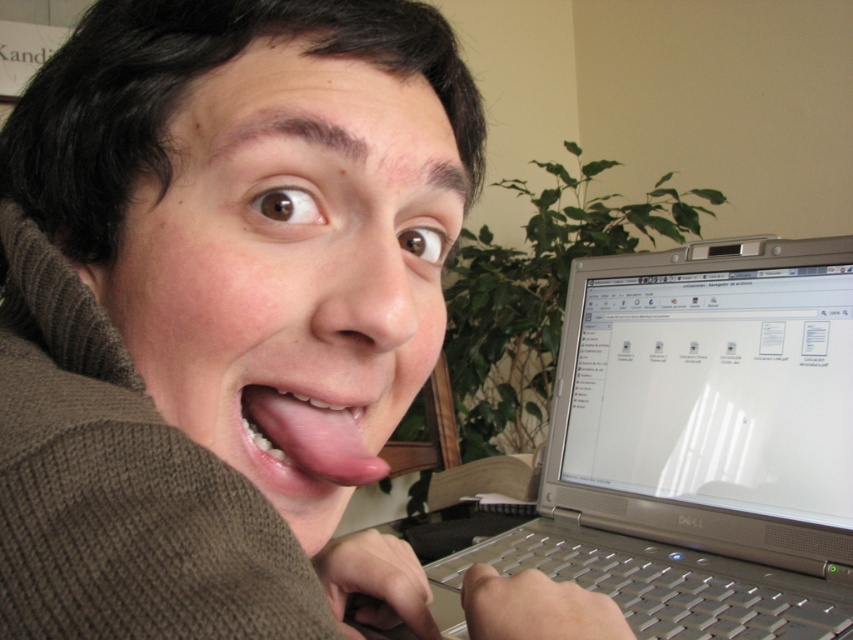
You are a photographer trying to capture the silver metallic laptop at upper right in focus while keeping the matte brown sweater at center visible but slightly blurred. Is the laptop at a different depth compared to the sweater?

The matte brown sweater at center is positioned over the silver metallic laptop at upper right, meaning the sweater is closer to the camera. To focus on the laptop, you would need to adjust the depth of field so that the sweater is blurred while the laptop remains sharp, as they are at different depths.

You are a photographer trying to capture a candid shot of the silver metallic laptop at right and the pink glossy tongue at center. Since the laptop is on the right side of the tongue, where should you position your camera to ensure both objects are in frame?

The silver metallic laptop at right is positioned on the right side of the pink glossy tongue at center, so to capture both in frame, position the camera to the left of the tongue to include the laptop on the right and the tongue at center.

You are organizing a desk and need to place two laptops. The matte silver laptop at center and the silver metallic laptop at right must be arranged so that the matte one is to the left of the silver one. Does the current setup meet this requirement?

Yes, the current setup meets the requirement because the matte silver laptop at center is positioned on the left side of the silver metallic laptop at right.